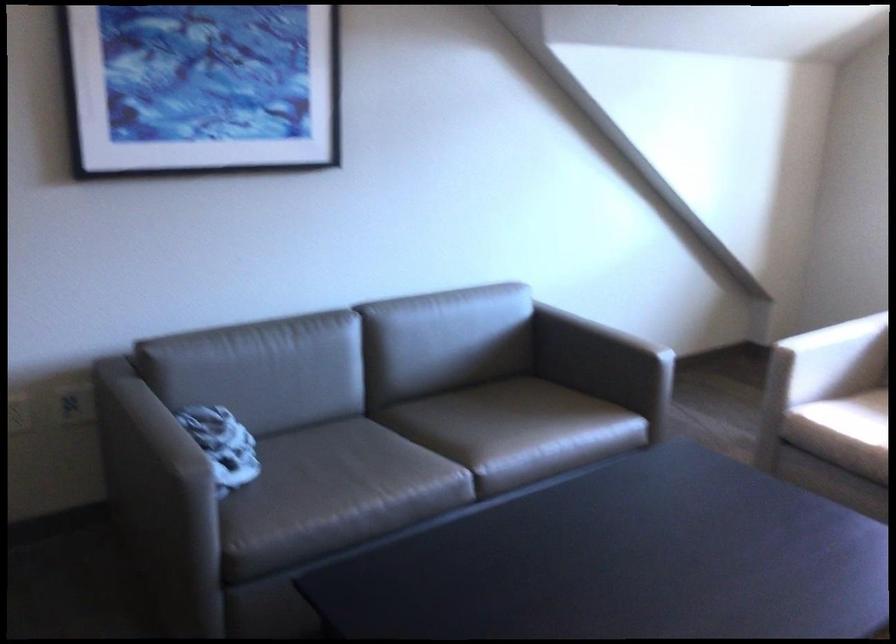
Where would you sit the sofa sitting surface? Please return your answer as a coordinate pair (x, y).

(497, 430)